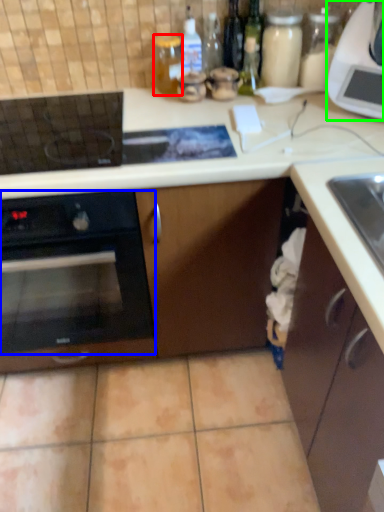
Question: Based on their relative distances, which object is farther from bottle (highlighted by a red box)? Choose from oven (highlighted by a blue box) and kitchen appliance (highlighted by a green box).

Choices:
 (A) oven
 (B) kitchen appliance

Answer: (A)